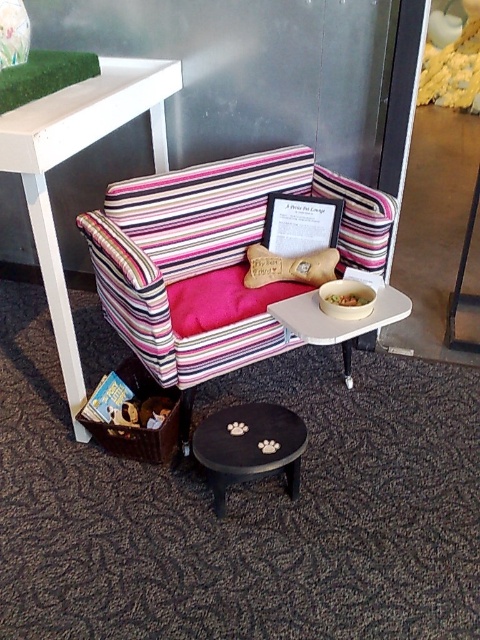
You are a small pet trying to reach the smooth yellow bowl at center from the black matte side table at lower center. Can you walk directly to the bowl without moving the table?

The black matte side table at lower center is in front of the smooth yellow bowl at center, so the table is blocking the direct path. You need to move the table to reach the bowl.

You are a pet owner who wants to place a new toy between the leather bone at center and the smooth yellow bowl at center. The toy is 10 cm in length. Can the toy fit in the space between them?

The leather bone at center is bigger than the smooth yellow bowl at center, but the exact distance between them isn not specified. Without knowing the space between them, it is impossible to determine if the toy will fit.